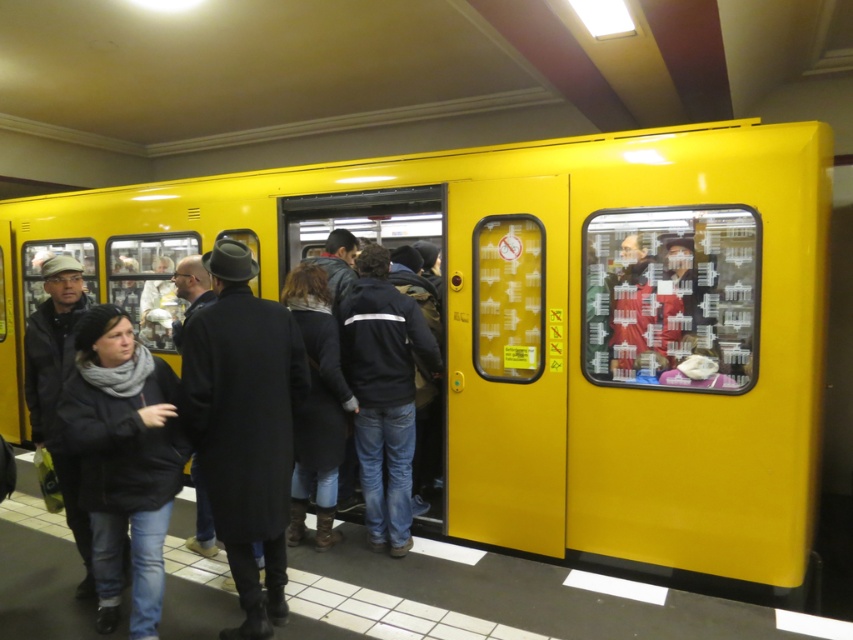
You are a passenger waiting to board the train and are standing on the platform. You notice the metallic yellow train at center and the black wool coat at center. Which object is closer to you?

The metallic yellow train at center is closer to you because it is further to the viewer than the black wool coat at center, meaning it appears nearer in the visual perspective.

You are a passenger waiting to board the train. You are standing at the black wool coat at center. The train doors are about to close. Can you reach the metallic yellow train at center before the doors close if you walk at a normal speed of 1.5 meters per second?

The metallic yellow train at center is 1.77 meters from black wool coat at center. At a walking speed of 1.5 meters per second, it would take approximately 1.18 seconds to cover the distance. Since the doors are about to close, it is possible to reach the train before the doors close if you move quickly.

You are a person trying to board the train but need to pass between the black wool coat at center and the black matte coat at lower left. Can you walk through the space between them without touching either coat?

The black wool coat at center and the black matte coat at lower left are 12.60 inches apart, so the space between them is too narrow for a person to walk through without touching either coat.